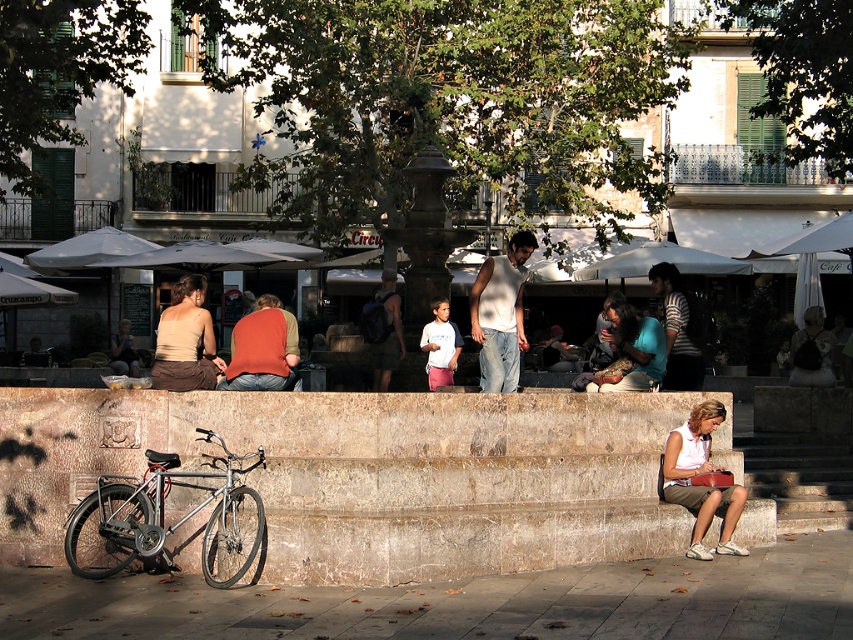
Does white cotton tank top at center have a lesser height compared to striped shirt at center?

Incorrect, white cotton tank top at center's height does not fall short of striped shirt at center's.

Does point (518, 320) lie behind point (660, 294)?

No, (518, 320) is in front of (660, 294).

Is point (473, 324) positioned in front of point (654, 284)?

Yes, it is in front of point (654, 284).

Find the location of `white cotton tank top at center`. white cotton tank top at center is located at coordinates (500, 314).

Which is in front, point (701, 545) or point (637, 336)?

Positioned in front is point (701, 545).

Between white cotton blouse at lower right and matte black hair at center, which one appears on the right side from the viewer's perspective?

white cotton blouse at lower right

Looking at this image, measure the distance between white cotton blouse at lower right and camera.

→ They are 11.70 meters apart.

I want to click on white cotton blouse at lower right, so click(699, 474).

Can you confirm if marble steps at center is smaller than matte brown dress at lower left?

Indeed, marble steps at center has a smaller size compared to matte brown dress at lower left.

Can you confirm if marble steps at center is taller than matte brown dress at lower left?

Incorrect, marble steps at center's height is not larger of matte brown dress at lower left's.

Is point (125, 445) behind point (196, 288)?

No, (125, 445) is in front of (196, 288).

The image size is (853, 640). What are the coordinates of `marble steps at center` in the screenshot? It's located at (373, 474).